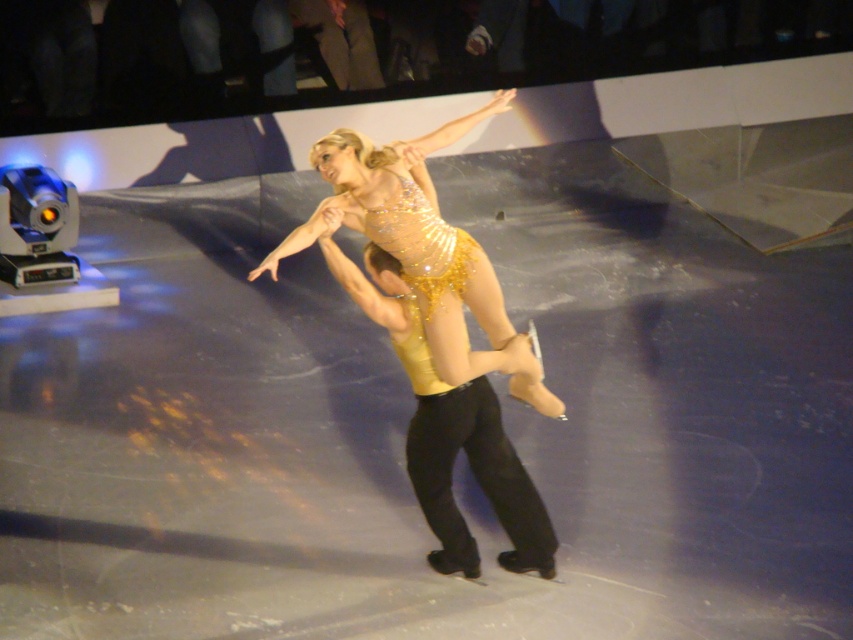
Is gold shiny pants at center to the left of sparkly gold dress at center from the viewer's perspective?

Correct, you'll find gold shiny pants at center to the left of sparkly gold dress at center.

Can you confirm if gold shiny pants at center is thinner than sparkly gold dress at center?

Yes, gold shiny pants at center is thinner than sparkly gold dress at center.

Locate an element on the screen. This screenshot has width=853, height=640. gold shiny pants at center is located at coordinates (448, 429).

This screenshot has height=640, width=853. What are the coordinates of `gold shiny pants at center` in the screenshot? It's located at (448, 429).